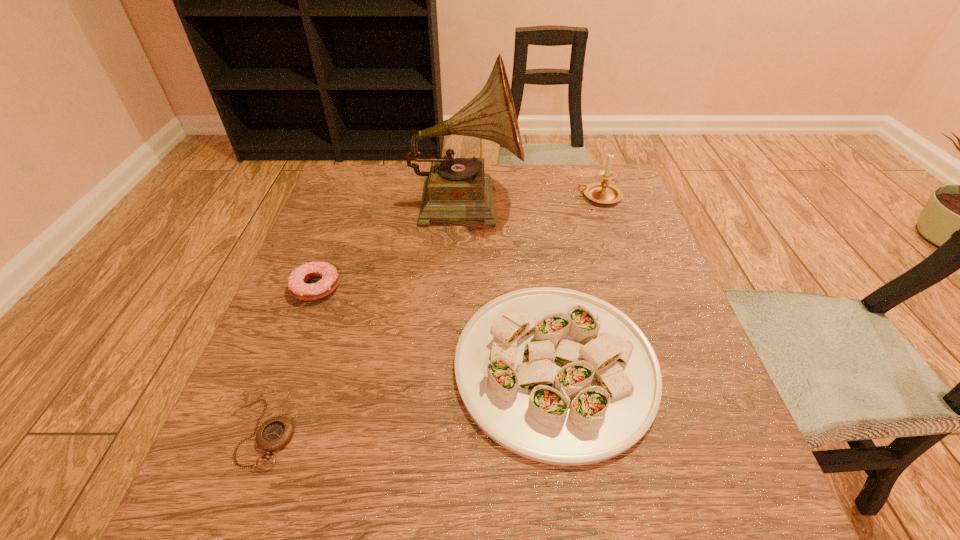
Locate an element on the screen. vacant space situated 0.050m on the front of the doughnut is located at coordinates (302, 324).

Locate an element on the screen. The image size is (960, 540). free space located 0.110m on the back of the shortest object is located at coordinates (295, 347).

Where is `record player that is at the far edge`? The height and width of the screenshot is (540, 960). record player that is at the far edge is located at coordinates (456, 189).

This screenshot has height=540, width=960. Find the location of `candle holder that is at the far edge`. candle holder that is at the far edge is located at coordinates (602, 192).

This screenshot has height=540, width=960. I want to click on platter that is positioned at the near edge, so click(x=558, y=376).

In order to click on pocket watch at the near edge in this screenshot , I will do `click(275, 433)`.

Identify the location of doughnut that is at the left edge. The image size is (960, 540). (297, 286).

This screenshot has width=960, height=540. In order to click on pocket watch located in the left edge section of the desktop in this screenshot , I will do `click(275, 433)`.

Find the location of a particular element. The width and height of the screenshot is (960, 540). candle holder located at the right edge is located at coordinates (602, 192).

This screenshot has width=960, height=540. Find the location of `platter at the right edge`. platter at the right edge is located at coordinates (558, 376).